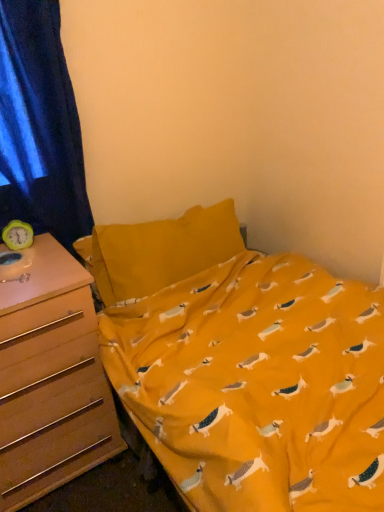
Question: Can you confirm if blue velvet curtain at left is positioned to the left of wooden drawer at left?

Choices:
 (A) yes
 (B) no

Answer: (B)

Question: Can you confirm if blue velvet curtain at left is bigger than wooden drawer at left?

Choices:
 (A) yes
 (B) no

Answer: (B)

Question: Are blue velvet curtain at left and wooden drawer at left located far from each other?

Choices:
 (A) yes
 (B) no

Answer: (B)

Question: Is the surface of blue velvet curtain at left in direct contact with wooden drawer at left?

Choices:
 (A) no
 (B) yes

Answer: (A)

Question: Considering the relative positions of blue velvet curtain at left and wooden drawer at left in the image provided, is blue velvet curtain at left in front of wooden drawer at left?

Choices:
 (A) no
 (B) yes

Answer: (A)

Question: Can we say blue velvet curtain at left lies outside wooden drawer at left?

Choices:
 (A) no
 (B) yes

Answer: (B)

Question: From a real-world perspective, is wooden drawer at left positioned over blue velvet curtain at left based on gravity?

Choices:
 (A) no
 (B) yes

Answer: (A)

Question: Considering the relative sizes of wooden drawer at left and blue velvet curtain at left in the image provided, is wooden drawer at left smaller than blue velvet curtain at left?

Choices:
 (A) yes
 (B) no

Answer: (B)

Question: Can you confirm if wooden drawer at left is positioned to the right of blue velvet curtain at left?

Choices:
 (A) yes
 (B) no

Answer: (B)

Question: Would you say blue velvet curtain at left is part of wooden drawer at left's contents?

Choices:
 (A) no
 (B) yes

Answer: (A)

Question: From the image's perspective, would you say wooden drawer at left is positioned over blue velvet curtain at left?

Choices:
 (A) no
 (B) yes

Answer: (A)

Question: Is the depth of wooden drawer at left greater than that of blue velvet curtain at left?

Choices:
 (A) no
 (B) yes

Answer: (A)

Question: In terms of width, does blue velvet curtain at left look wider or thinner when compared to wooden drawer at left?

Choices:
 (A) wide
 (B) thin

Answer: (B)